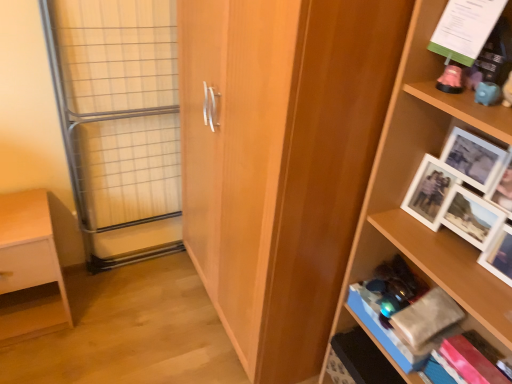
Where is `free space above white matte wooden shelf at lower left, acting as the first shelf starting from the left (from a real-world perspective)`? Image resolution: width=512 pixels, height=384 pixels. free space above white matte wooden shelf at lower left, acting as the first shelf starting from the left (from a real-world perspective) is located at coordinates (20, 215).